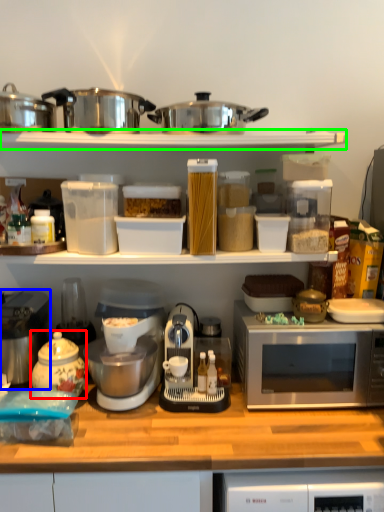
Question: Which object is the closest to the tea pot (highlighted by a red box)? Choose among these: home appliance (highlighted by a blue box) or shelf (highlighted by a green box).

Choices:
 (A) home appliance
 (B) shelf

Answer: (A)